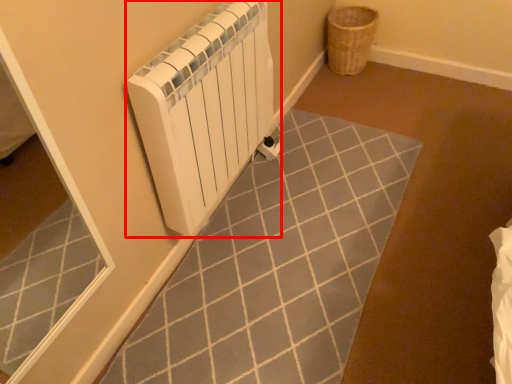
Question: Where is bath heater (annotated by the red box) located in relation to basket in the image?

Choices:
 (A) left
 (B) right

Answer: (A)